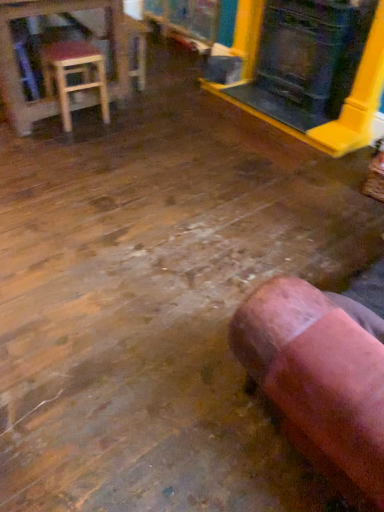
Image resolution: width=384 pixels, height=512 pixels. Describe the element at coordinates (74, 73) in the screenshot. I see `wooden stool at left` at that location.

What do you see at coordinates (318, 380) in the screenshot? I see `pink suede bean bag chair at lower right` at bounding box center [318, 380].

Find the location of `matte black fireplace at upper right`. matte black fireplace at upper right is located at coordinates (345, 101).

Would you say pink suede bean bag chair at lower right contains matte black fireplace at upper right?

No.

From a real-world perspective, does pink suede bean bag chair at lower right sit lower than matte black fireplace at upper right?

Yes, from a real-world perspective, pink suede bean bag chair at lower right is below matte black fireplace at upper right.

You are a GUI agent. You are given a task and a screenshot of the screen. Output one action in this format:
    pyautogui.click(x=<x>, y=<y>)
    Task: Click on the bean bag chair lying in front of the matte black fireplace at upper right
    The width and height of the screenshot is (384, 512).
    Given the screenshot: What is the action you would take?
    pyautogui.click(x=318, y=380)

Measure the distance between matte black fireplace at upper right and pink suede bean bag chair at lower right.

The distance of matte black fireplace at upper right from pink suede bean bag chair at lower right is 6.97 feet.

What are the coordinates of `fireplace that appears behind the pink suede bean bag chair at lower right` in the screenshot? It's located at (345, 101).

From the image's perspective, which one is positioned higher, matte black fireplace at upper right or pink suede bean bag chair at lower right?

matte black fireplace at upper right appears higher in the image.

Is point (237, 14) less distant than point (283, 410)?

No, (237, 14) is further to viewer.

Is wooden stool at upper left positioned with its back to matte black fireplace at upper right?

That's not correct — wooden stool at upper left is not looking away from matte black fireplace at upper right.

From the image's perspective, which is above, wooden stool at upper left or matte black fireplace at upper right?

wooden stool at upper left, from the image's perspective.

Considering the sizes of wooden stool at upper left and matte black fireplace at upper right in the image, is wooden stool at upper left bigger or smaller than matte black fireplace at upper right?

wooden stool at upper left is bigger than matte black fireplace at upper right.

Would you say wooden stool at upper left is a long distance from matte black fireplace at upper right?

Yes, wooden stool at upper left and matte black fireplace at upper right are quite far apart.

Between matte black fireplace at upper right and wooden stool at upper left, which one has less height?

wooden stool at upper left.

Is the surface of matte black fireplace at upper right in direct contact with wooden stool at upper left?

No, matte black fireplace at upper right is not with wooden stool at upper left.

From a real-world perspective, which is physically below, matte black fireplace at upper right or wooden stool at upper left?

From a 3D spatial view, wooden stool at upper left is below.

In terms of size, does matte black fireplace at upper right appear bigger or smaller than wooden stool at upper left?

In the image, matte black fireplace at upper right appears to be smaller than wooden stool at upper left.

Considering the sizes of wooden stool at upper left and wooden stool at left in the image, is wooden stool at upper left taller or shorter than wooden stool at left?

Considering their sizes, wooden stool at upper left has more height than wooden stool at left.

This screenshot has height=512, width=384. In order to click on table located above the wooden stool at left (from a real-world perspective) in this screenshot , I will do `click(70, 63)`.

In the image, is wooden stool at upper left positioned in front of or behind wooden stool at left?

Clearly, wooden stool at upper left is behind wooden stool at left.

Is wooden stool at upper left not close to wooden stool at left?

No, wooden stool at upper left is in close proximity to wooden stool at left.

Based on the photo, considering the relative sizes of pink suede bean bag chair at lower right and wooden stool at upper left in the image provided, is pink suede bean bag chair at lower right smaller than wooden stool at upper left?

Actually, pink suede bean bag chair at lower right might be larger than wooden stool at upper left.

From a real-world perspective, is pink suede bean bag chair at lower right under wooden stool at upper left?

Actually, pink suede bean bag chair at lower right is physically above wooden stool at upper left in the real world.

Is pink suede bean bag chair at lower right aimed at wooden stool at upper left?

Yes, pink suede bean bag chair at lower right is turned towards wooden stool at upper left.

From the image's perspective, which one is positioned higher, pink suede bean bag chair at lower right or wooden stool at upper left?

From the image's view, wooden stool at upper left is above.

Can you confirm if wooden stool at left is bigger than wooden stool at upper left?

Actually, wooden stool at left might be smaller than wooden stool at upper left.

Considering the sizes of wooden stool at left and wooden stool at upper left in the image, is wooden stool at left taller or shorter than wooden stool at upper left?

wooden stool at left is shorter than wooden stool at upper left.

Can you tell me how much wooden stool at left and wooden stool at upper left differ in facing direction?

The angle between the facing direction of wooden stool at left and the facing direction of wooden stool at upper left is 83.4 degrees.

From a real-world perspective, relative to wooden stool at upper left, is wooden stool at left vertically above or below?

wooden stool at left is below wooden stool at upper left.

The image size is (384, 512). Identify the location of bean bag chair on the left side of matte black fireplace at upper right. (318, 380).

The image size is (384, 512). Find the location of `fireplace on the right side of pink suede bean bag chair at lower right`. fireplace on the right side of pink suede bean bag chair at lower right is located at coordinates (345, 101).

From the image, which object appears to be farther from wooden stool at upper left, wooden stool at left or matte black fireplace at upper right?

Based on the image, matte black fireplace at upper right appears to be further to wooden stool at upper left.

Based on their spatial positions, is pink suede bean bag chair at lower right or wooden stool at left closer to wooden stool at upper left?

wooden stool at left lies closer to wooden stool at upper left than the other object.

Estimate the real-world distances between objects in this image. Which object is closer to matte black fireplace at upper right, wooden stool at upper left or pink suede bean bag chair at lower right?

The object closer to matte black fireplace at upper right is wooden stool at upper left.

Which object lies nearer to the anchor point matte black fireplace at upper right, wooden stool at left or pink suede bean bag chair at lower right?

wooden stool at left is positioned closer to the anchor matte black fireplace at upper right.

Consider the image. When comparing their distances from wooden stool at left, does matte black fireplace at upper right or wooden stool at upper left seem further?

matte black fireplace at upper right is positioned further to the anchor wooden stool at left.

Considering their positions, is wooden stool at left positioned closer to pink suede bean bag chair at lower right than wooden stool at upper left?

Among the two, wooden stool at left is located nearer to pink suede bean bag chair at lower right.

Looking at the image, which one is located closer to wooden stool at left, wooden stool at upper left or matte black fireplace at upper right?

wooden stool at upper left lies closer to wooden stool at left than the other object.

When comparing their distances from wooden stool at left, does matte black fireplace at upper right or pink suede bean bag chair at lower right seem closer?

Among the two, matte black fireplace at upper right is located nearer to wooden stool at left.

This screenshot has height=512, width=384. I want to click on stool between wooden stool at upper left and matte black fireplace at upper right from left to right, so click(74, 73).

You are a GUI agent. You are given a task and a screenshot of the screen. Output one action in this format:
    pyautogui.click(x=<x>, y=<y>)
    Task: Click on the fireplace between pink suede bean bag chair at lower right and wooden stool at left along the z-axis
    This screenshot has width=384, height=512.
    Given the screenshot: What is the action you would take?
    pyautogui.click(x=345, y=101)

The image size is (384, 512). I want to click on fireplace between pink suede bean bag chair at lower right and wooden stool at upper left along the z-axis, so click(x=345, y=101).

Locate an element on the screen. stool positioned between pink suede bean bag chair at lower right and wooden stool at upper left from near to far is located at coordinates (74, 73).